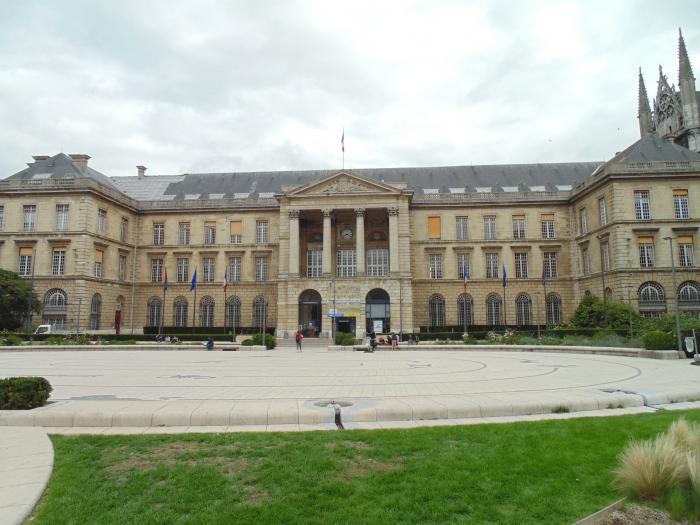
At what (x,y) coordinates should I click in order to perform the action: click on pillars. Please return your answer as a coordinate pair (x, y). The width and height of the screenshot is (700, 525). Looking at the image, I should click on (294, 230), (327, 231), (362, 229), (392, 228).